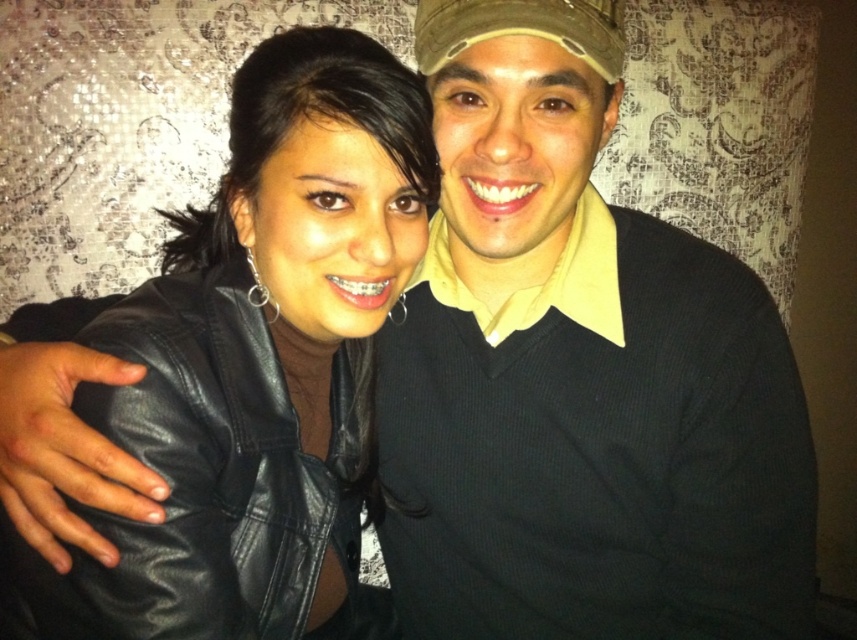
Question: Which object is farther from the camera taking this photo?

Choices:
 (A) black leather jacket at center
 (B) black sweater at center

Answer: (A)

Question: Is black sweater at center positioned behind black leather jacket at center?

Choices:
 (A) no
 (B) yes

Answer: (A)

Question: Which point is farther to the camera?

Choices:
 (A) (508, 496)
 (B) (327, 337)

Answer: (B)

Question: Does black sweater at center have a lesser width compared to black leather jacket at center?

Choices:
 (A) no
 (B) yes

Answer: (B)

Question: Does black sweater at center have a smaller size compared to black leather jacket at center?

Choices:
 (A) no
 (B) yes

Answer: (B)